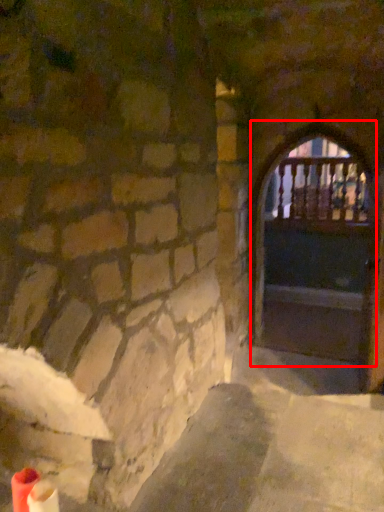
Question: Considering the relative positions of door (annotated by the red box) and window in the image provided, where is door (annotated by the red box) located with respect to the staircase?

Choices:
 (A) left
 (B) right

Answer: (A)